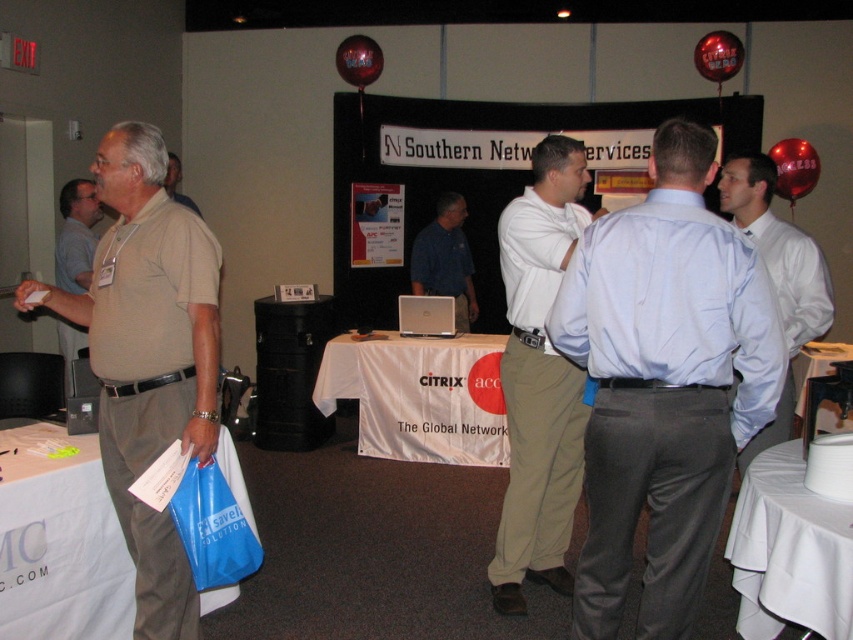
Does khakimaterial/texture at left have a smaller size compared to beige cotton polo shirt at left?

Actually, khakimaterial/texture at left might be larger than beige cotton polo shirt at left.

How much distance is there between khakimaterial/texture at left and beige cotton polo shirt at left?

khakimaterial/texture at left is 5.96 feet from beige cotton polo shirt at left.

Measure the distance between point (x=122, y=253) and camera.

2.31 meters

Where is `khakimaterial/texture at left`? Image resolution: width=853 pixels, height=640 pixels. khakimaterial/texture at left is located at coordinates (148, 356).

Between point (799, 188) and point (706, 45), which one is positioned in front?

Point (706, 45)

Looking at this image, between glossy metallic balloon at upper right and shiny metallic balloon at upper right, which one has less height?

shiny metallic balloon at upper right is shorter.

Between point (799, 144) and point (730, 54), which one is positioned in front?

Point (799, 144) is more forward.

Where is `glossy metallic balloon at upper right`? The image size is (853, 640). glossy metallic balloon at upper right is located at coordinates (793, 168).

Based on the photo, is khakimaterial/texture at left below khaki pants at center?

Indeed, khakimaterial/texture at left is positioned under khaki pants at center.

Is khakimaterial/texture at left positioned behind khaki pants at center?

That is False.

The image size is (853, 640). What are the coordinates of `khakimaterial/texture at left` in the screenshot? It's located at 148,356.